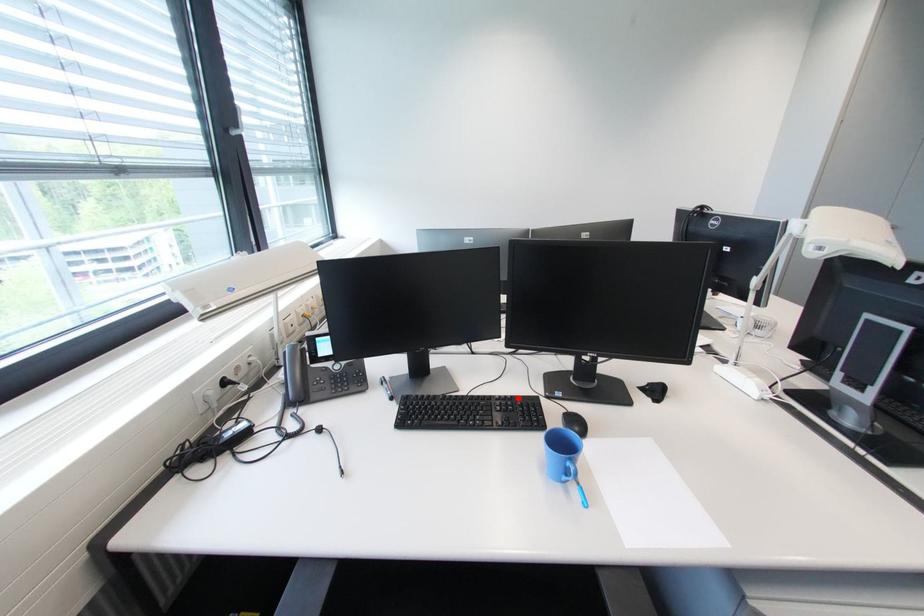
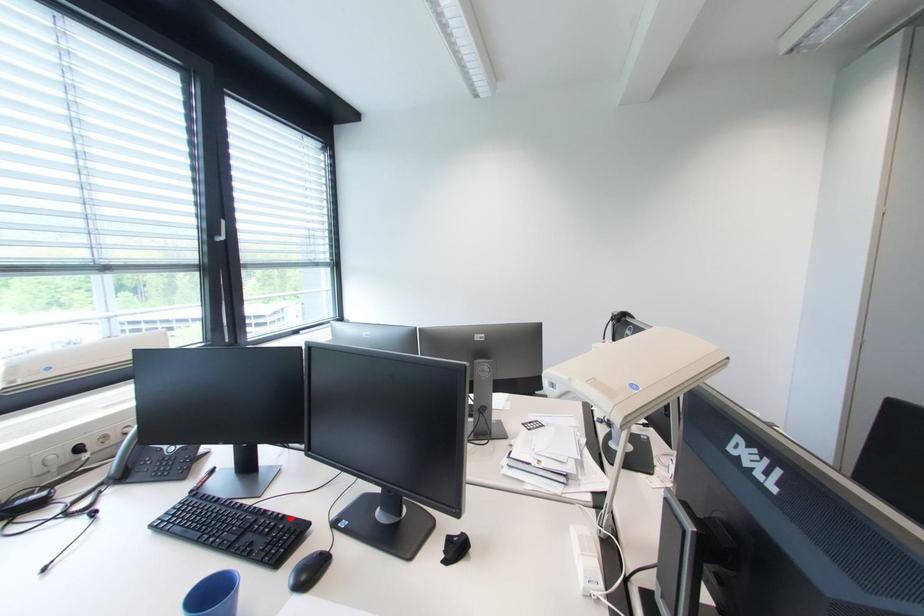
I am providing you with two images of the same scene from different viewpoints. A red point is marked on the first image and another point is marked on the second image. Does the point marked in image1 correspond to the same location as the one in image2?

Yes